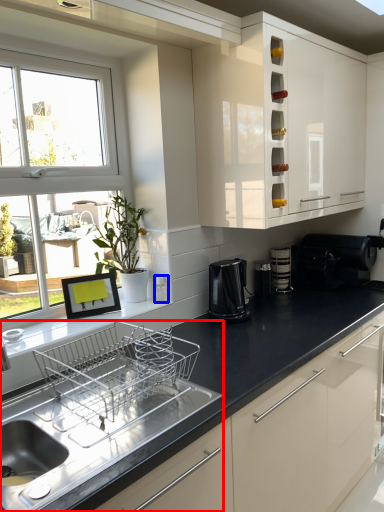
Question: Which object is closer to the camera taking this photo, sink (highlighted by a red box) or appliance (highlighted by a blue box)?

Choices:
 (A) sink
 (B) appliance

Answer: (A)